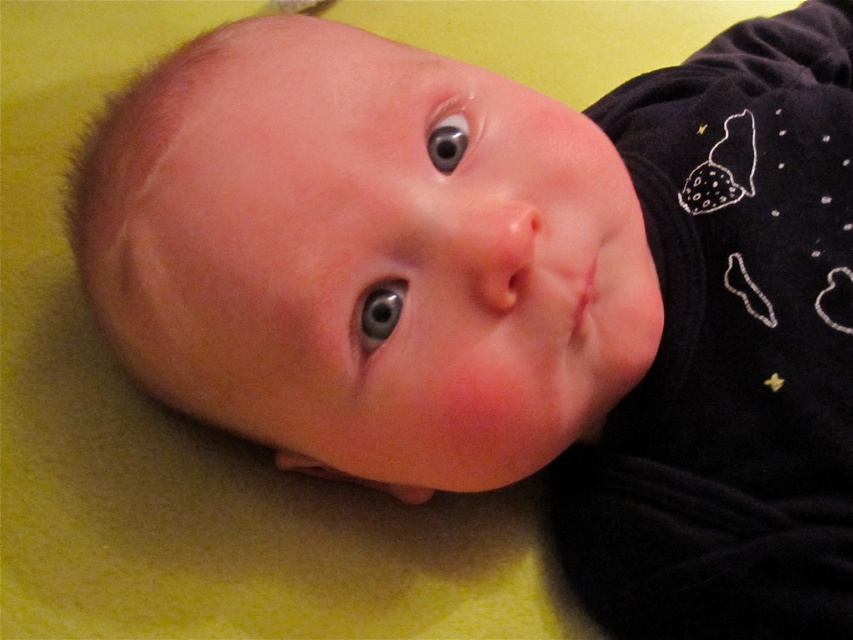
Question: Observing the image, what is the correct spatial positioning of blue glossy eye at center in reference to glossy gray eye at upper center?

Choices:
 (A) above
 (B) below

Answer: (B)

Question: Can you confirm if blue glossy eye at center is smaller than glossy gray eye at upper center?

Choices:
 (A) no
 (B) yes

Answer: (B)

Question: Observing the image, what is the correct spatial positioning of blue glossy eye at center in reference to glossy gray eye at upper center?

Choices:
 (A) right
 (B) left

Answer: (B)

Question: Which point is farther to the camera?

Choices:
 (A) glossy gray eye at upper center
 (B) blue glossy eye at center

Answer: (A)

Question: Which of the following is the closest to the observer?

Choices:
 (A) (437, 156)
 (B) (380, 288)

Answer: (B)